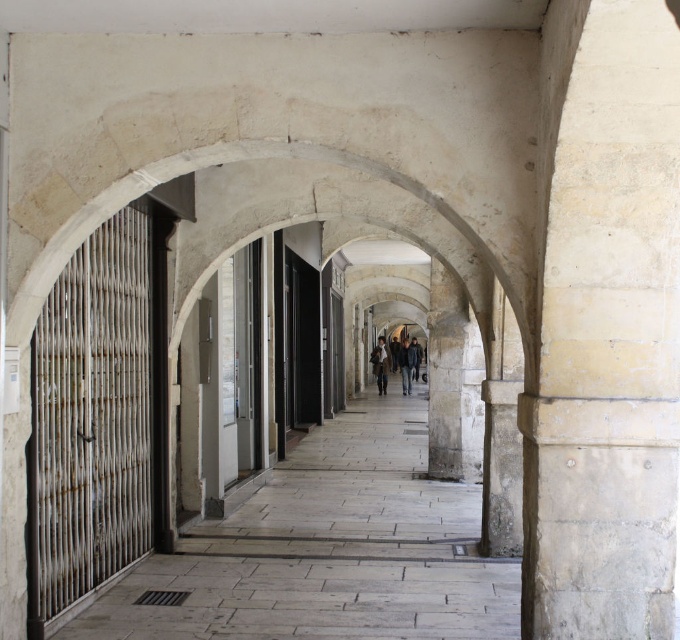
Question: Can you confirm if dark gray coat at center is positioned above dark blue jeans at center?

Choices:
 (A) no
 (B) yes

Answer: (B)

Question: From the image, what is the correct spatial relationship of dark gray coat at center in relation to dark blue jeans at center?

Choices:
 (A) below
 (B) above

Answer: (B)

Question: Which point is closer to the camera taking this photo?

Choices:
 (A) (403, 342)
 (B) (641, 461)
 (C) (318, 531)
 (D) (403, 387)

Answer: (B)

Question: Which of the following is the farthest from the observer?

Choices:
 (A) (405, 349)
 (B) (373, 369)

Answer: (B)

Question: Which object is the farthest from the dark blue jeans at center?

Choices:
 (A) light brown leather jacket at center
 (B) light beige stone pillar at center

Answer: (B)

Question: Considering the relative positions of light beige stone pillar at center and dark gray coat at center in the image provided, where is light beige stone pillar at center located with respect to dark gray coat at center?

Choices:
 (A) left
 (B) right

Answer: (A)